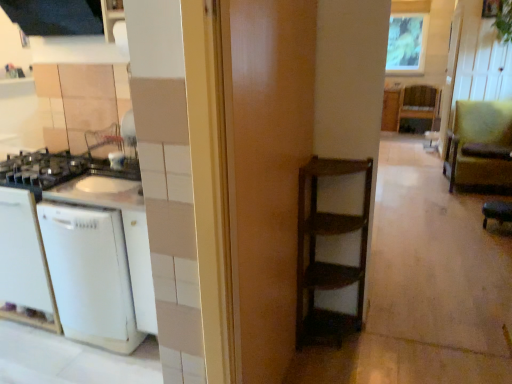
Question: Is green fabric armchair at right smaller than wooden frame at upper center?

Choices:
 (A) no
 (B) yes

Answer: (A)

Question: Would you consider green fabric armchair at right to be distant from wooden frame at upper center?

Choices:
 (A) yes
 (B) no

Answer: (A)

Question: Is green fabric armchair at right facing away from wooden frame at upper center?

Choices:
 (A) no
 (B) yes

Answer: (B)

Question: Is green fabric armchair at right taller than wooden frame at upper center?

Choices:
 (A) no
 (B) yes

Answer: (A)

Question: Is green fabric armchair at right thinner than wooden frame at upper center?

Choices:
 (A) yes
 (B) no

Answer: (B)

Question: Does green fabric armchair at right appear on the right side of wooden frame at upper center?

Choices:
 (A) yes
 (B) no

Answer: (B)

Question: From the image's perspective, is green fabric armchair at right located beneath green leather bar stool at lower right?

Choices:
 (A) no
 (B) yes

Answer: (A)

Question: Considering the relative sizes of green fabric armchair at right and green leather bar stool at lower right in the image provided, is green fabric armchair at right thinner than green leather bar stool at lower right?

Choices:
 (A) no
 (B) yes

Answer: (A)

Question: Does green fabric armchair at right lie in front of green leather bar stool at lower right?

Choices:
 (A) yes
 (B) no

Answer: (B)

Question: Is green fabric armchair at right further to the viewer compared to green leather bar stool at lower right?

Choices:
 (A) yes
 (B) no

Answer: (A)

Question: From the image's perspective, would you say green fabric armchair at right is positioned over green leather bar stool at lower right?

Choices:
 (A) no
 (B) yes

Answer: (B)

Question: Is green fabric armchair at right bigger than green leather bar stool at lower right?

Choices:
 (A) yes
 (B) no

Answer: (A)

Question: Would you say wooden door at center is part of white matte dishwasher at left's contents?

Choices:
 (A) no
 (B) yes

Answer: (A)